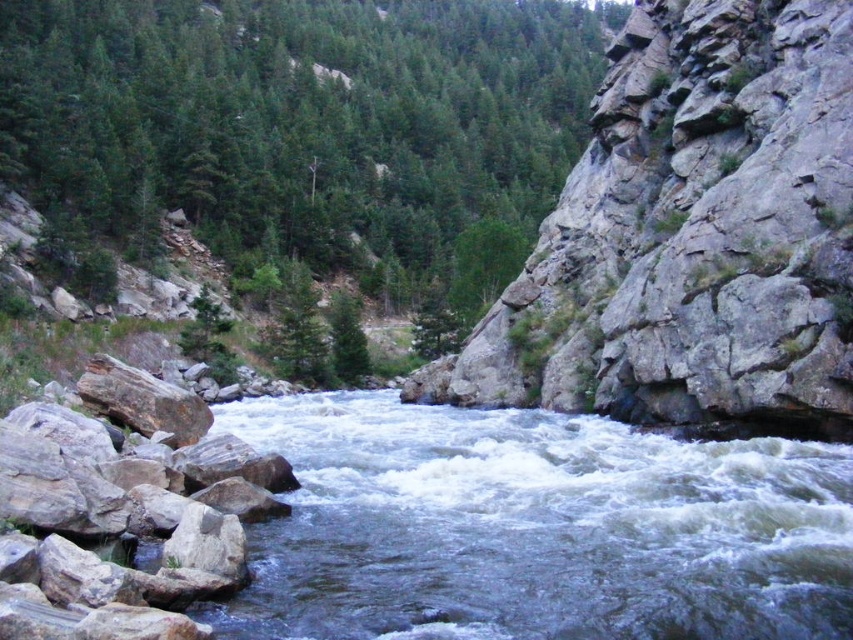
You are a hiker standing at the edge of the river and want to cross to the other side. You see the green matte tree at upper center and the clear water at center. Which object is closer to you as you plan your path?

The green matte tree at upper center is closer to you than the clear water at center, so you should consider the proximity of the tree when planning your crossing route.

You are a kayaker planning to navigate the river in the image. You see the clear water at center and the gray rough rock at lower left. Which path should you choose to avoid obstacles and ensure a smoother ride?

You should choose the clear water at center because it is wider than the gray rough rock at lower left, offering a smoother and safer path with fewer obstacles.